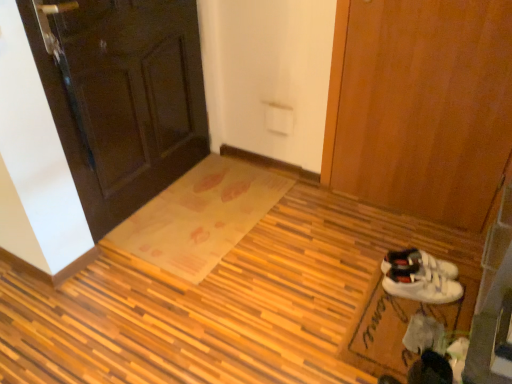
Locate an element on the screen. The width and height of the screenshot is (512, 384). free space between wooden door at right, the 2th door positioned from the left, and white fabric doormat at lower right, which ranks as the second doormat in back-to-front order is located at coordinates (379, 245).